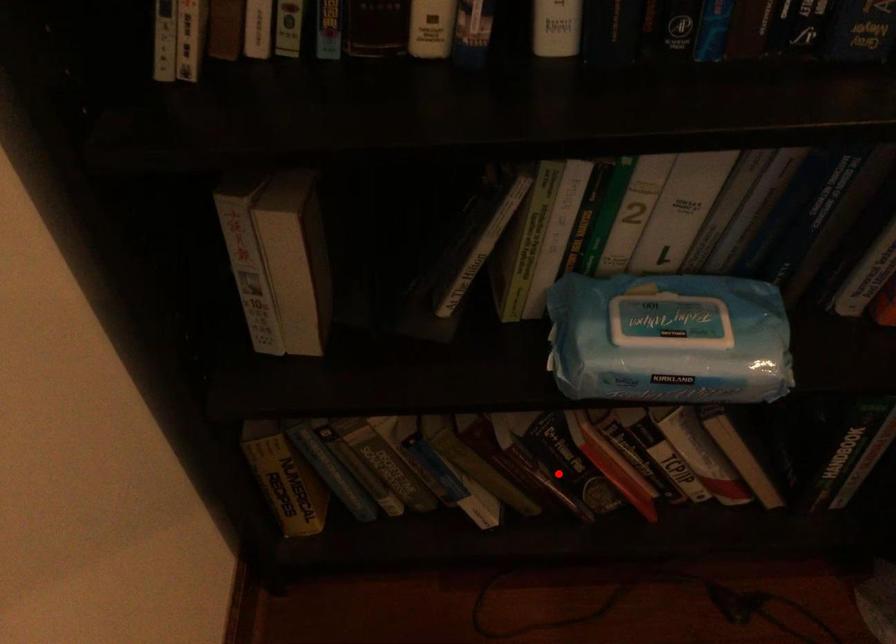
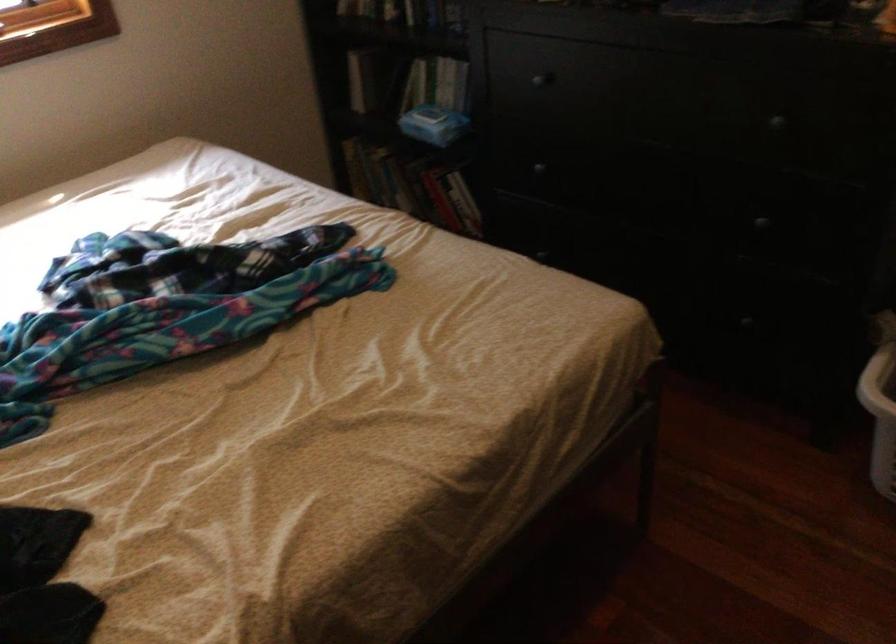
Question: I am providing you with two images of the same scene from different viewpoints. Given a red point in image1, look at the same physical point in image2. Is it:

Choices:
 (A) Closer to the viewpoint
 (B) Farther from the viewpoint

Answer: (B)